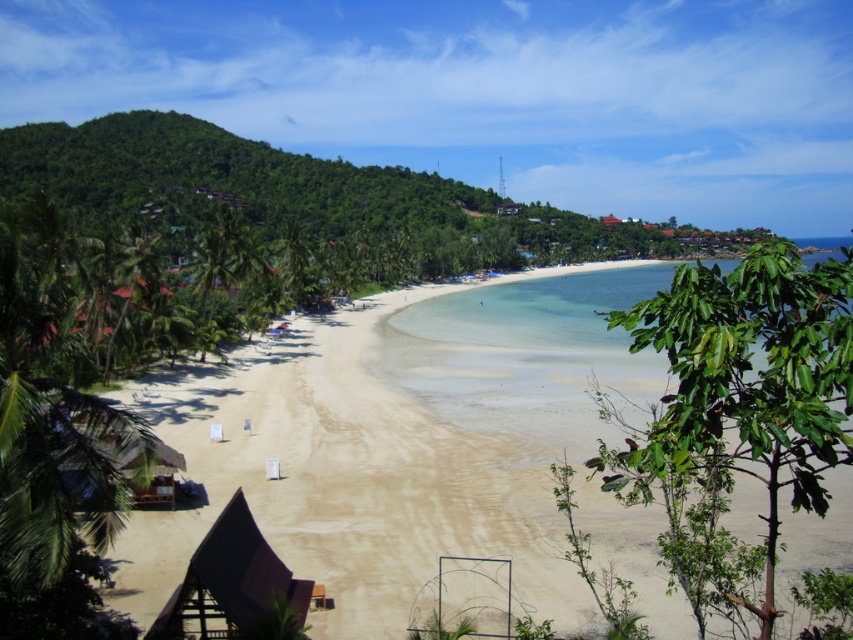
You are standing on the white sand beach at center and want to walk to the green leafy palm tree at right. Which direction should you face to ensure you are moving towards the tree?

Since the white sand beach at center is wider than the green leafy palm tree at right, you should face towards the right direction to move towards the green leafy palm tree at right.

You are a photographer planning to capture the entire white sand beach at center and the brown wooden hut at lower left in a single shot. Based on the scene, which object occupies more horizontal space in the image?

The white sand beach at center occupies more horizontal space in the image because its width is larger than that of the brown wooden hut at lower left.

You are planning to set up a small tent between the green leafy palm tree at right and the brown wooden hut at lower left. Considering their widths, which object will require more space horizontally to accommodate the tent without overlapping?

The green leafy palm tree at right has a greater width than the brown wooden hut at lower left, so it will require more horizontal space to accommodate the tent without overlapping.